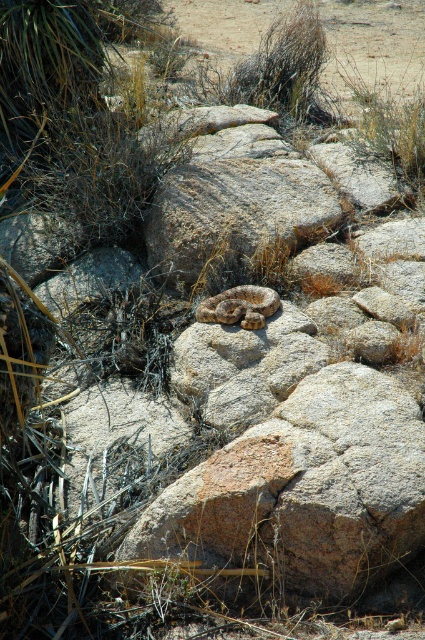
You are standing at the origin point in the desert scene. The rusty stone boulder at center is located at coordinates 0.327, 0.555. If you want to reach the boulder, in which direction should you move relative to your current position?

The rusty stone boulder at center is located at coordinates (235, 209). Since you are at the origin point, you should move in the direction of increasing x and y coordinates to reach the boulder.

You are a hiker who has spotted the rusty stone boulder at center and the brown scaly snake at center in the desert. Which object is located higher in elevation?

The rusty stone boulder at center is positioned over the brown scaly snake at center, so the rusty stone boulder at center is higher in elevation.